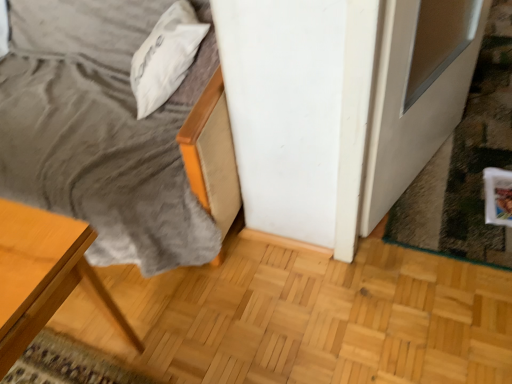
Where is `unoccupied area in front of white glossy screen door at lower right`? The image size is (512, 384). unoccupied area in front of white glossy screen door at lower right is located at coordinates (447, 213).